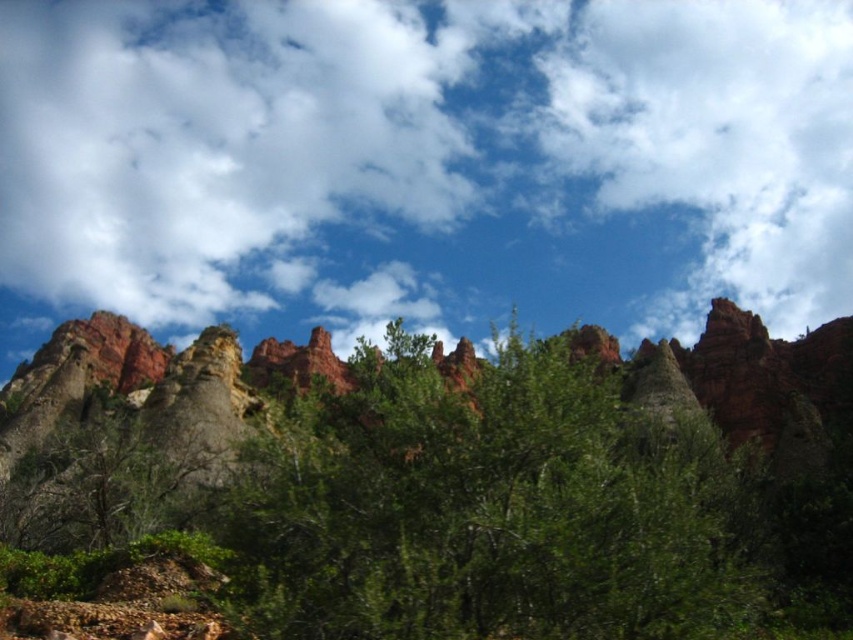
Question: Can you confirm if white fluffy cloud at upper center is wider than green leafy tree at center?

Choices:
 (A) yes
 (B) no

Answer: (A)

Question: Which point is farther to the camera?

Choices:
 (A) (239, 106)
 (B) (531, 352)

Answer: (A)

Question: Is white fluffy cloud at upper center positioned behind green leafy tree at center?

Choices:
 (A) no
 (B) yes

Answer: (B)

Question: Is white fluffy cloud at upper center positioned before green leafy tree at center?

Choices:
 (A) no
 (B) yes

Answer: (A)

Question: Which point is closer to the camera taking this photo?

Choices:
 (A) (704, 483)
 (B) (677, 108)

Answer: (A)

Question: Which point is farther from the camera taking this photo?

Choices:
 (A) pos(486,416)
 (B) pos(258,134)

Answer: (B)